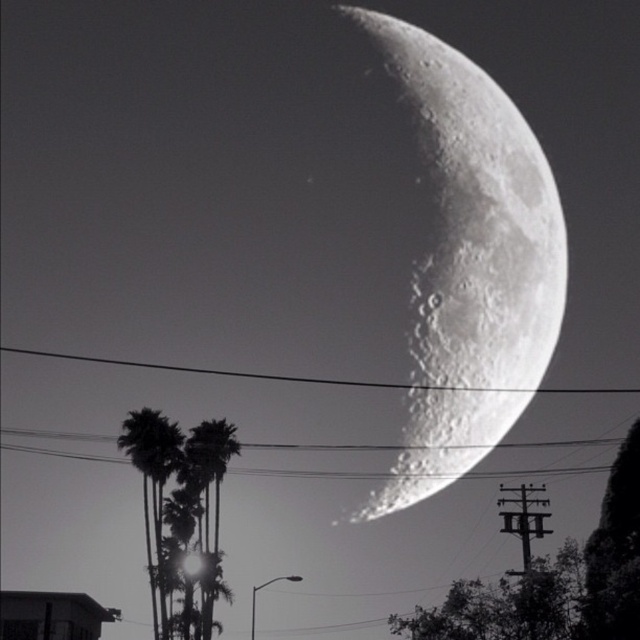
Question: Which of the following is the farthest from the observer?

Choices:
 (A) green leafy palm tree at center
 (B) metallic wire at upper center

Answer: (B)

Question: Is the position of green leafy palm tree at center less distant than that of metallic wire at upper center?

Choices:
 (A) yes
 (B) no

Answer: (A)

Question: Which of these objects is positioned farthest from the metallic wire at upper center?

Choices:
 (A) green leafy palm tree at center
 (B) silhouette palm trees at lower left

Answer: (B)

Question: Does green leafy palm tree at center lie in front of metallic wire at upper center?

Choices:
 (A) yes
 (B) no

Answer: (A)

Question: Can you confirm if green leafy palm tree at center is positioned above metallic wire at upper center?

Choices:
 (A) no
 (B) yes

Answer: (A)

Question: Estimate the real-world distances between objects in this image. Which object is farther from the silhouette palm trees at lower left?

Choices:
 (A) metallic wire at upper center
 (B) green leafy palm tree at center

Answer: (A)